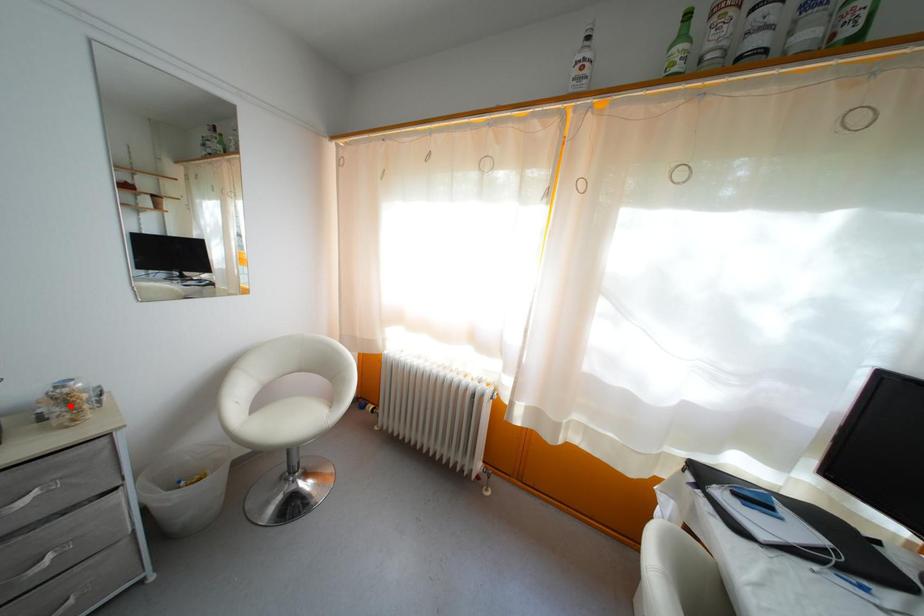
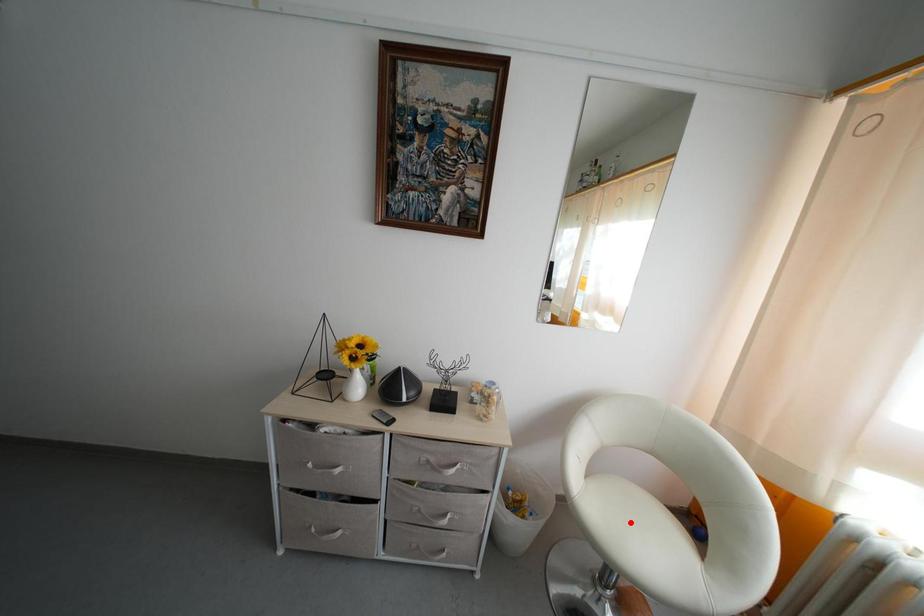
I am providing you with two images of the same scene from different viewpoints. A red point is marked on the first image and another point is marked on the second image. Does the point marked in image1 correspond to the same location as the one in image2?

No